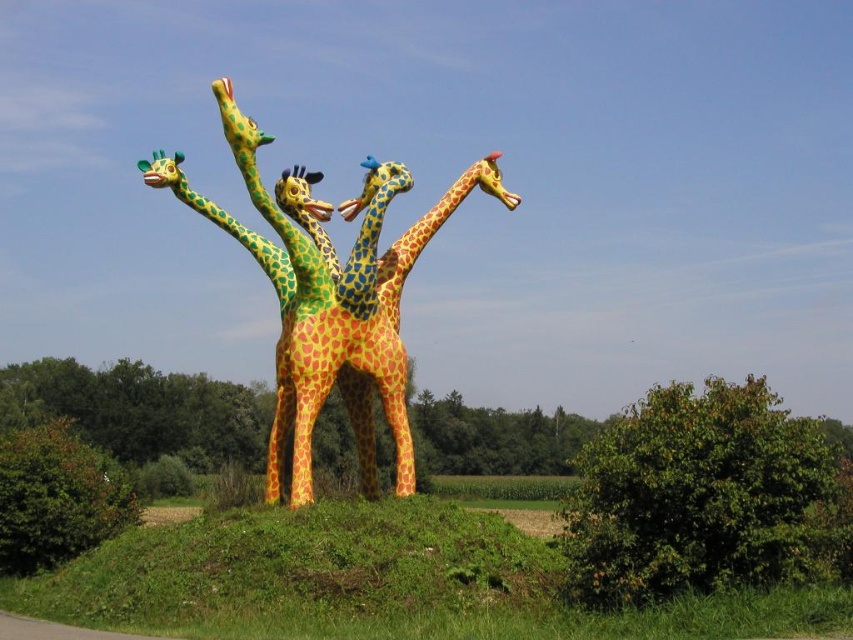
You are standing in front of the glossy painted giraffes at center in the outdoor scene. If you want to take a closer photo of them without moving, would you need to use a zoom lens? Explain why.

The glossy painted giraffes at center are 39.73 feet away from the camera. Since they are relatively far away, using a zoom lens would allow you to capture them in focus and detail without moving closer.

You are standing in the outdoor scene and want to take a photo of the glossy painted giraffes at center without the green leafy bush at center blocking the view. Which direction should you move to ensure the bush is out of the frame?

You should move behind the green leafy bush at center so that the glossy painted giraffes at center come into view without obstruction.

You are a gardener planning to plant a new flower bed between the green leafy bush at center and the green matte tree at center. Which object should you place the flower bed closer to so that it is equidistant from both?

The flower bed should be placed closer to the green leafy bush at center because it has a smaller width than the green matte tree at center, allowing for equal spacing between both.